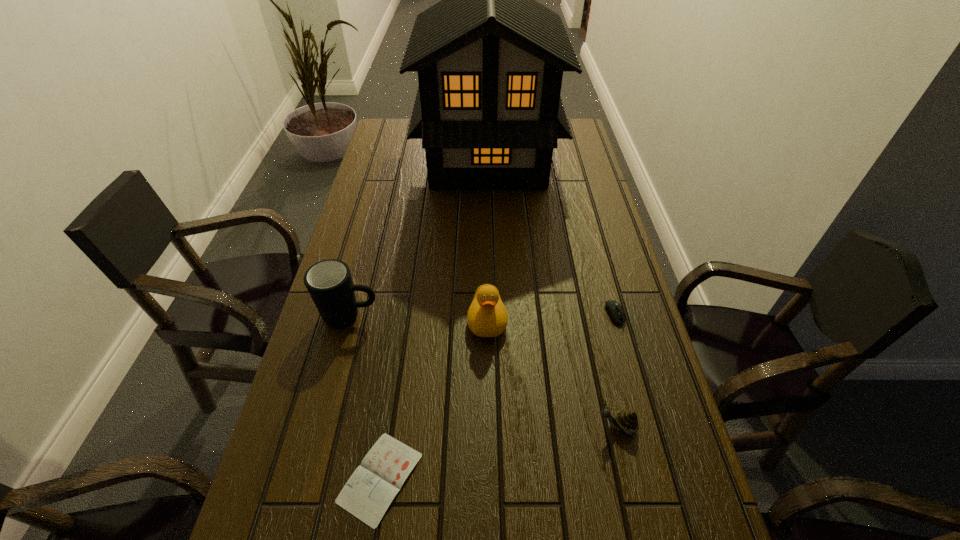
Image resolution: width=960 pixels, height=540 pixels. I want to click on snail that is at the right edge, so click(627, 421).

Locate an element on the screen. The image size is (960, 540). computer mouse that is at the right edge is located at coordinates (614, 309).

Identify the location of object situated at the far right corner. This screenshot has height=540, width=960. (490, 59).

In the image, there is a desktop. In order to click on vacant space at the left edge in this screenshot , I will do `click(398, 201)`.

Find the location of `vacant area at the right edge of the desktop`. vacant area at the right edge of the desktop is located at coordinates (637, 498).

You are a GUI agent. You are given a task and a screenshot of the screen. Output one action in this format:
    pyautogui.click(x=<x>, y=<y>)
    Task: Click on the free space between the fifth shortest object and the dollhouse
    This screenshot has width=960, height=540.
    Given the screenshot: What is the action you would take?
    [x=420, y=238]

Identify the location of free area in between the diary and the mug. The height and width of the screenshot is (540, 960). (366, 397).

You are a GUI agent. You are given a task and a screenshot of the screen. Output one action in this format:
    pyautogui.click(x=<x>, y=<y>)
    Task: Click on the vacant space that's between the diary and the computer mouse
    
    Given the screenshot: What is the action you would take?
    pyautogui.click(x=497, y=397)

What are the coordinates of `free space between the duck and the computer mouse` in the screenshot? It's located at click(x=551, y=318).

Image resolution: width=960 pixels, height=540 pixels. What are the coordinates of `free space between the third tallest object and the second tallest object` in the screenshot? It's located at (419, 318).